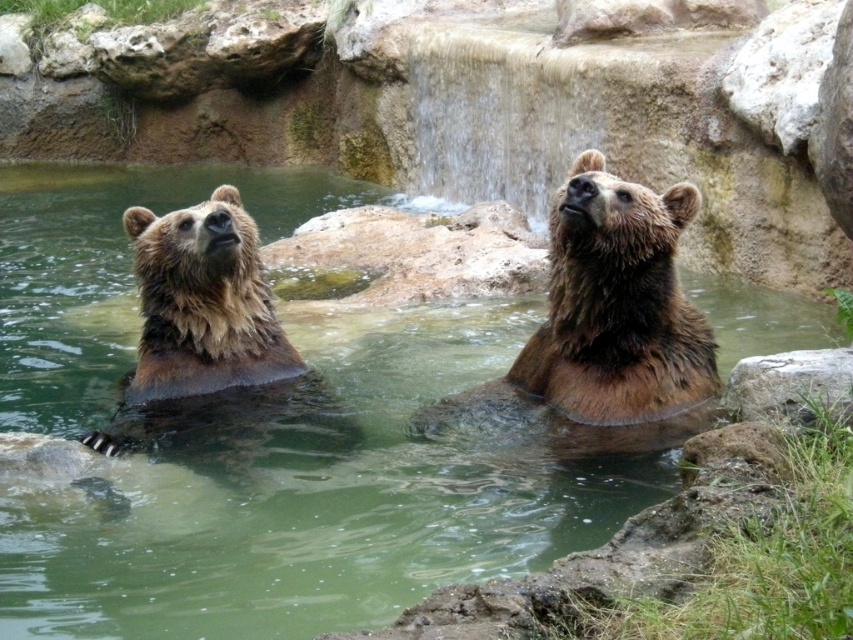
You are observing two points in the image of the bears in the water. Which point, point (143, 605) or point (567, 452), is closer to you?

Point (143, 605) is closer to the camera than point (567, 452).

You are a zookeeper who needs to ensure the brown furry bear at left has enough space to move freely in the green liquid water at center. Based on the scene, can the bear comfortably swim across the water?

The green liquid water at center has a larger width than the brown furry bear at left, so yes, the bear can comfortably swim across the water.